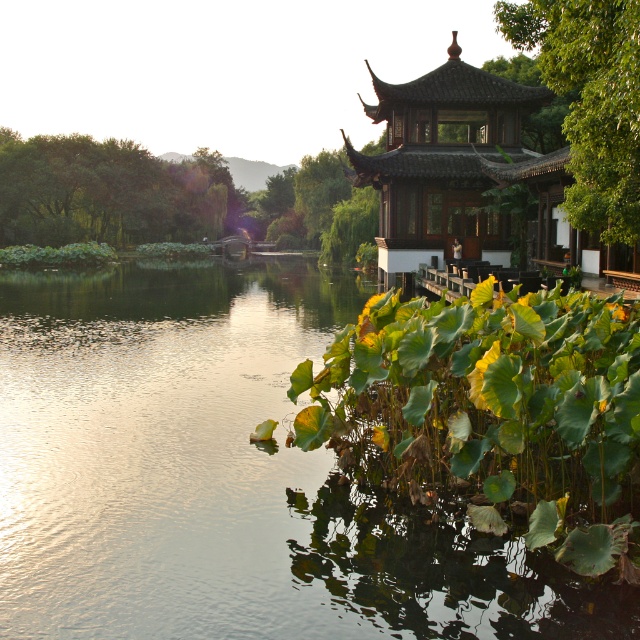
You are a visitor in the garden and want to take a photo of both the green reflective water at lower left and the green leafy trees at left. Which object should you focus on first if you want to capture both in one frame without moving your camera?

You should focus on the green reflective water at lower left first because it is closer to you than the green leafy trees at left, allowing both to be in the same frame.